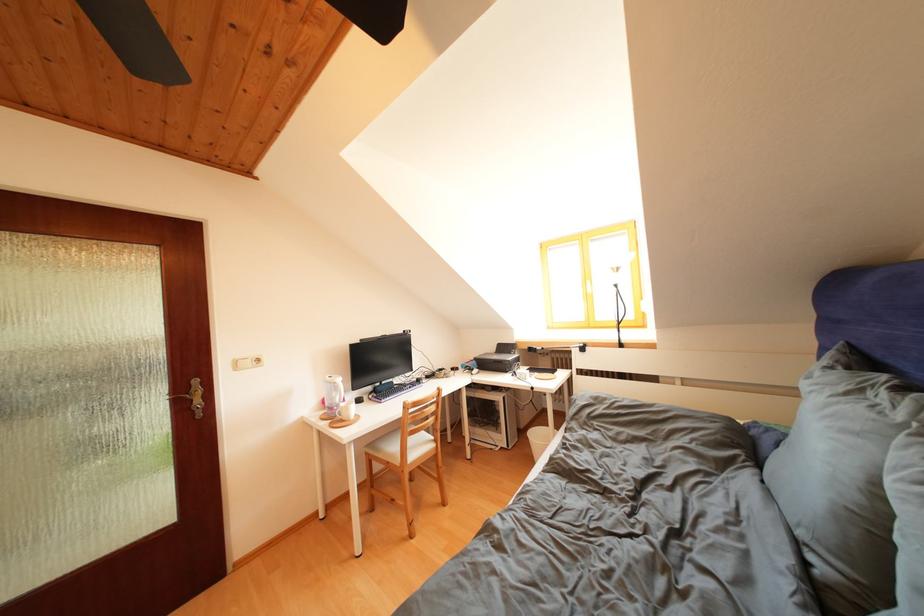
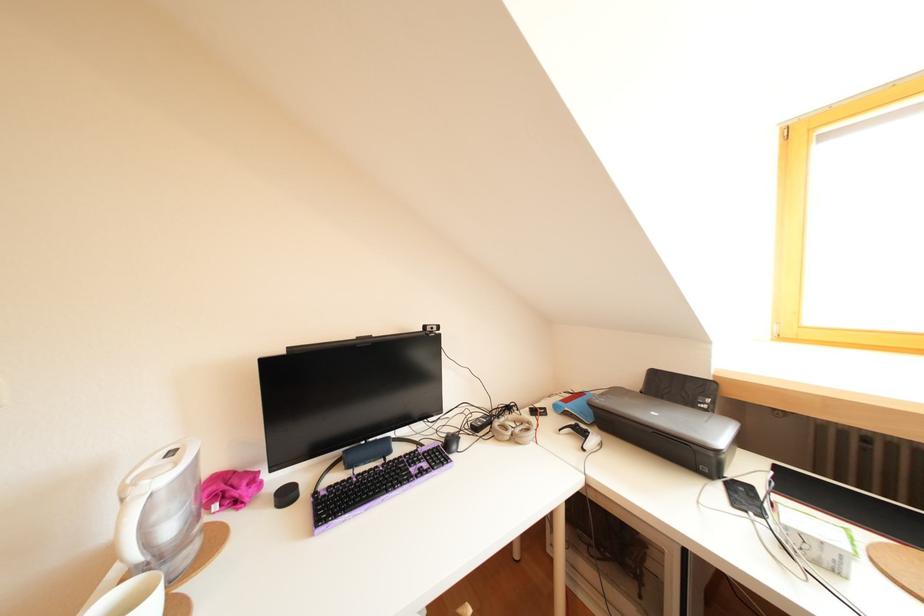
The point at [448,376] is marked in the first image. Where is the corresponding point in the second image?

(516, 413)